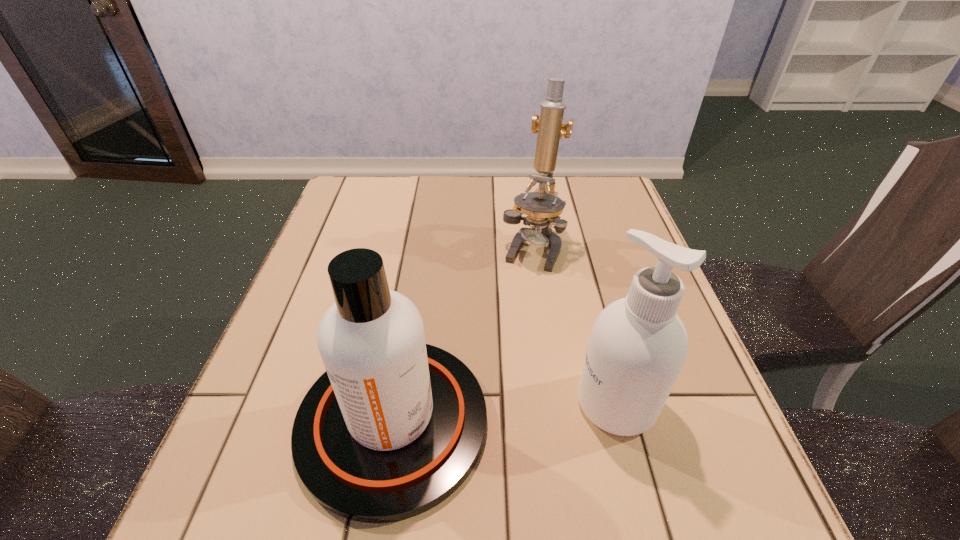
You are a GUI agent. You are given a task and a screenshot of the screen. Output one action in this format:
    pyautogui.click(x=<x>, y=<y>)
    Task: Click on the microscope
    The image size is (960, 540).
    Given the screenshot: What is the action you would take?
    pyautogui.click(x=543, y=207)

At what (x,y) coordinates should I click in order to perform the action: click on the right cleansing agent. Please return your answer as a coordinate pair (x, y). This screenshot has height=540, width=960. Looking at the image, I should click on tap(638, 345).

Locate an element on the screen. The image size is (960, 540). the left cleansing agent is located at coordinates (394, 426).

Locate an element on the screen. The height and width of the screenshot is (540, 960). blank area located on the back of the microscope is located at coordinates (525, 201).

Locate an element on the screen. free space located on the front label of the right cleansing agent is located at coordinates (497, 403).

The width and height of the screenshot is (960, 540). Identify the location of free space located 0.120m on the front label of the right cleansing agent. (509, 403).

At what (x,y) coordinates should I click in order to perform the action: click on vacant space situated 0.310m on the front label of the right cleansing agent. Please return your answer as a coordinate pair (x, y). Looking at the image, I should click on (401, 403).

This screenshot has height=540, width=960. Identify the location of vacant space positioned 0.290m on the right of the leftmost object. (657, 422).

The height and width of the screenshot is (540, 960). In order to click on object located at the near edge in this screenshot , I will do `click(394, 426)`.

What are the coordinates of `object that is at the left edge` in the screenshot? It's located at (394, 426).